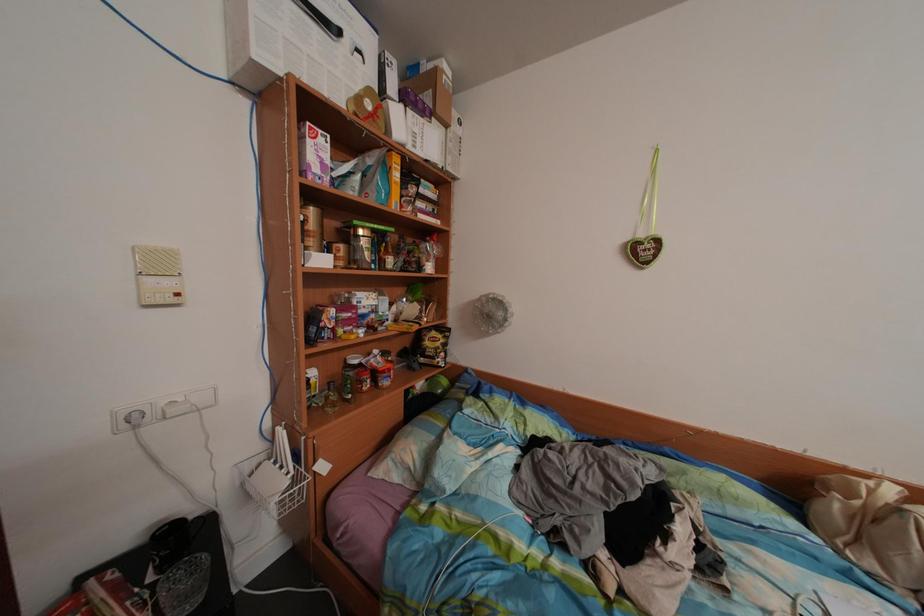
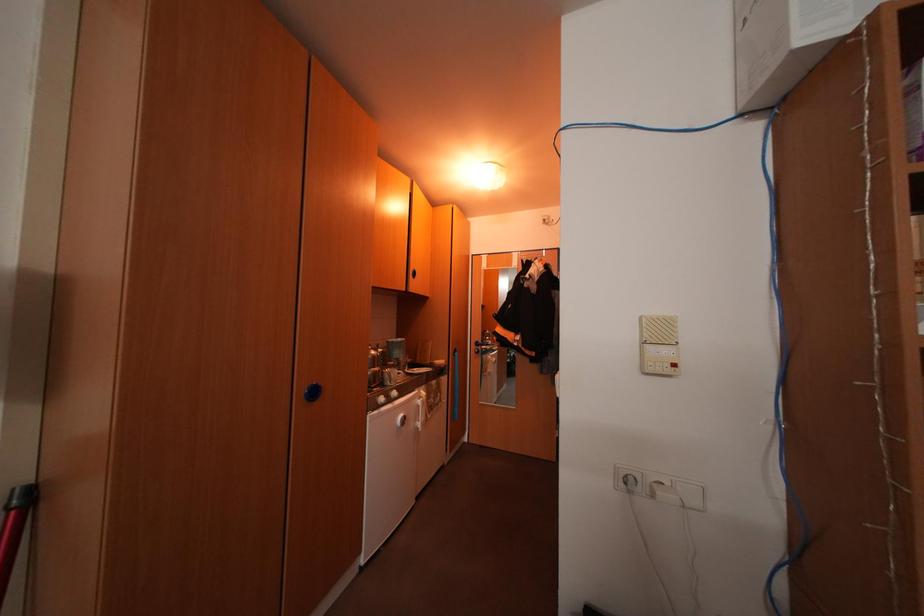
Question: How did the camera likely rotate?

Choices:
 (A) Left
 (B) Right
 (C) Up
 (D) Down

Answer: (A)